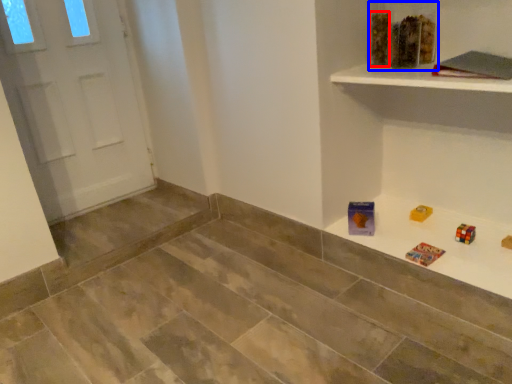
Question: Which object appears closest to the camera in this image, block (highlighted by a red box) or toy (highlighted by a blue box)?

Choices:
 (A) block
 (B) toy

Answer: (B)